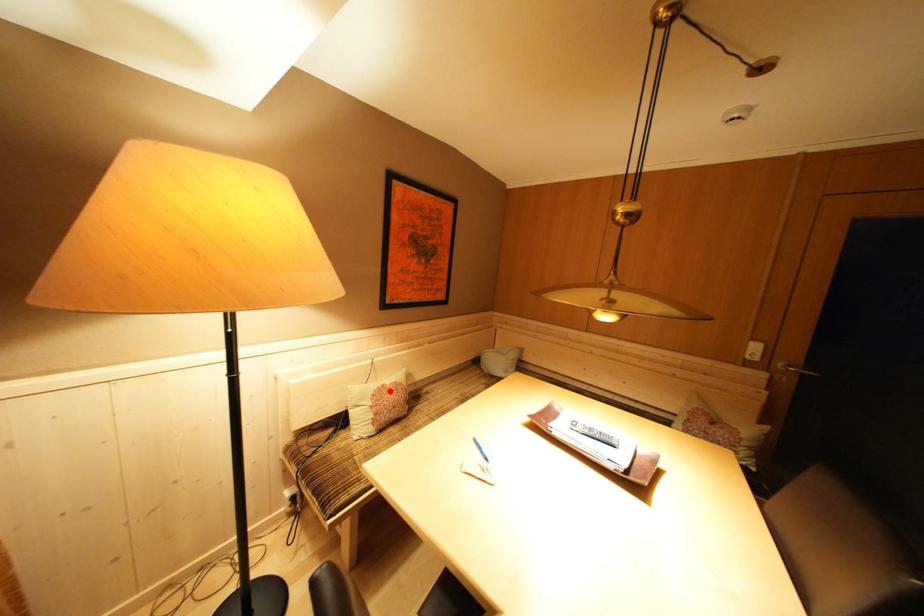
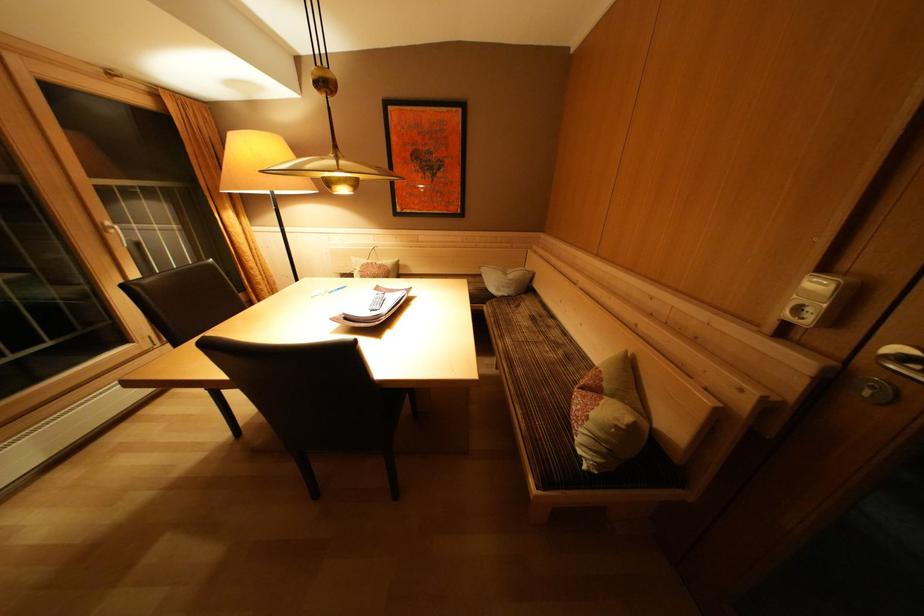
The point at the highlighted location is marked in the first image. Where is the corresponding point in the second image?

(379, 268)